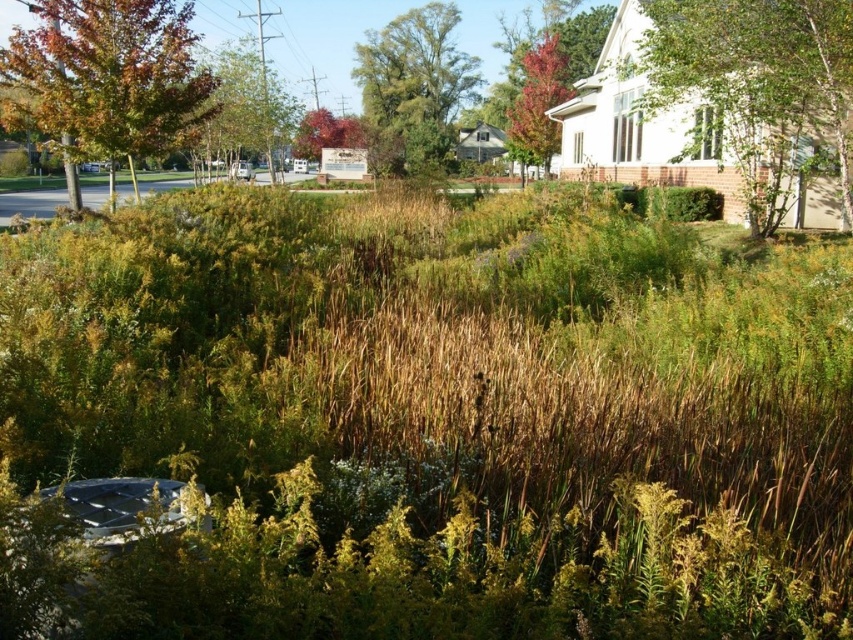
You are a gardener planning to plant a new tree in this suburban area. You have a small sapling that requires a space no larger than the green leafy tree at upper right. Would the space currently occupied by autumn leaves at upper left be suitable for planting this sapling?

The green leafy tree at upper right is smaller than autumn leaves at upper left, so the space occupied by autumn leaves at upper left is larger. Therefore, it would be suitable for planting the sapling as it provides enough space.

You are standing at the point labeled as point (758, 84) in the image. What is the nearest object to you in the scene?

The nearest object to you at point (758, 84) is the green leafy tree at upper right.